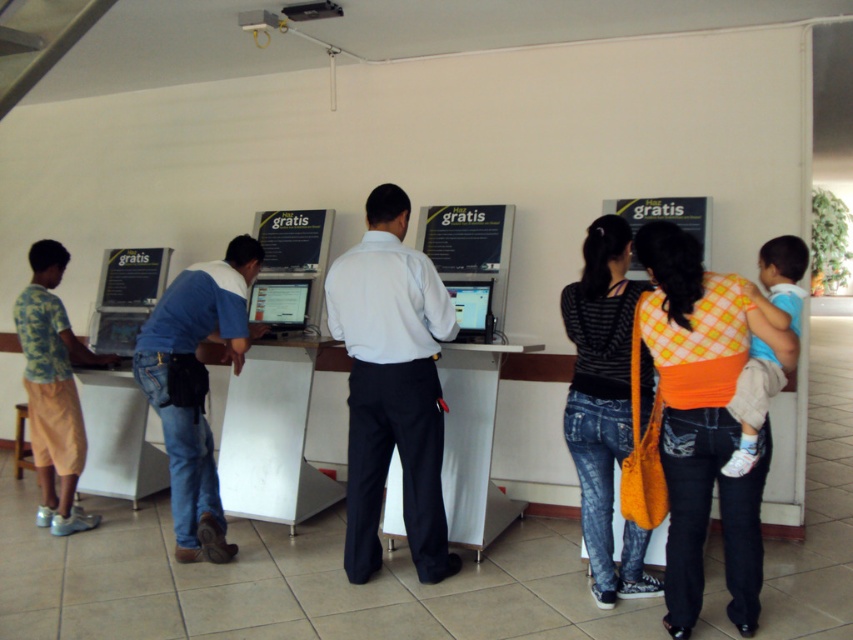
Question: Which object appears farthest from the camera in this image?

Choices:
 (A) orange checkered shirt at center
 (B) white shirt at center

Answer: (B)

Question: Is denim jeans at center below camo shirt at left?

Choices:
 (A) yes
 (B) no

Answer: (A)

Question: Which point is closer to the camera?

Choices:
 (A) (592, 419)
 (B) (325, 289)
 (C) (752, 564)
 (D) (22, 339)

Answer: (C)

Question: Is denim jeans at center thinner than blue jeans at center?

Choices:
 (A) no
 (B) yes

Answer: (B)

Question: Among these objects, which one is nearest to the camera?

Choices:
 (A) orange checkered shirt at center
 (B) camo shirt at left

Answer: (A)

Question: Does orange checkered shirt at center appear under denim jeans at center?

Choices:
 (A) yes
 (B) no

Answer: (A)